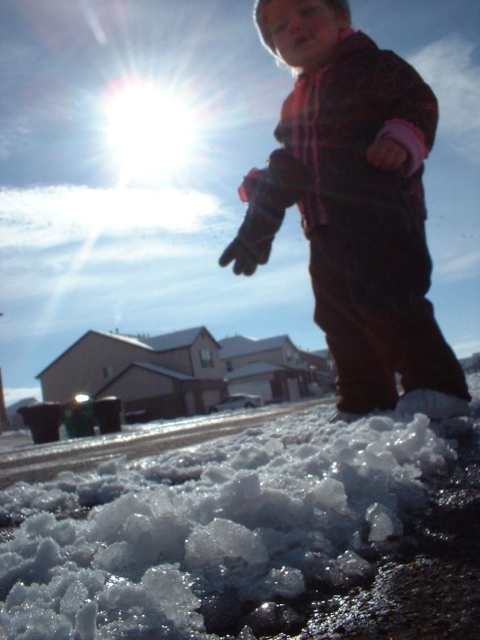
Can you confirm if white crystalline snow at lower center is positioned to the right of plaid fleece jacket at upper right?

In fact, white crystalline snow at lower center is to the left of plaid fleece jacket at upper right.

Which is more to the left, white crystalline snow at lower center or plaid fleece jacket at upper right?

white crystalline snow at lower center is more to the left.

Does point (175, 547) come farther from viewer compared to point (352, 342)?

No, (175, 547) is closer to viewer.

You are a GUI agent. You are given a task and a screenshot of the screen. Output one action in this format:
    pyautogui.click(x=<x>, y=<y>)
    Task: Click on the white crystalline snow at lower center
    This screenshot has width=480, height=640.
    Given the screenshot: What is the action you would take?
    pyautogui.click(x=247, y=534)